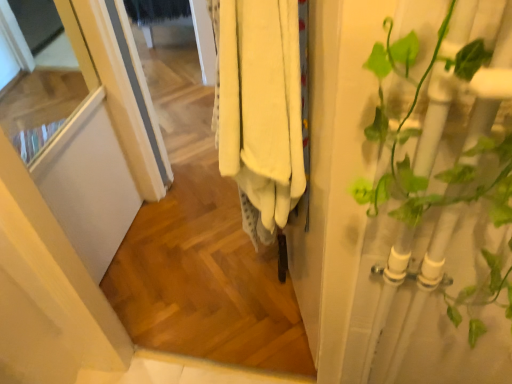
Question: Could you tell me if green leafy plant at right is turned towards white cotton towels at center?

Choices:
 (A) yes
 (B) no

Answer: (B)

Question: From a real-world perspective, is green leafy plant at right physically below white cotton towels at center?

Choices:
 (A) no
 (B) yes

Answer: (B)

Question: Would you say green leafy plant at right is a long distance from white cotton towels at center?

Choices:
 (A) yes
 (B) no

Answer: (B)

Question: Is green leafy plant at right facing away from white cotton towels at center?

Choices:
 (A) no
 (B) yes

Answer: (A)

Question: Is green leafy plant at right surrounding white cotton towels at center?

Choices:
 (A) yes
 (B) no

Answer: (B)

Question: Is green leafy plant at right outside of white cotton towels at center?

Choices:
 (A) yes
 (B) no

Answer: (A)

Question: Can you confirm if white matte screen door at left is bigger than green leafy plant at right?

Choices:
 (A) no
 (B) yes

Answer: (B)

Question: Considering the relative sizes of white matte screen door at left and green leafy plant at right in the image provided, is white matte screen door at left taller than green leafy plant at right?

Choices:
 (A) no
 (B) yes

Answer: (B)

Question: Is white matte screen door at left at the left side of green leafy plant at right?

Choices:
 (A) no
 (B) yes

Answer: (B)

Question: Is white matte screen door at left placed right next to green leafy plant at right?

Choices:
 (A) yes
 (B) no

Answer: (B)

Question: Does white matte screen door at left turn towards green leafy plant at right?

Choices:
 (A) yes
 (B) no

Answer: (B)

Question: Can you confirm if white matte screen door at left is smaller than green leafy plant at right?

Choices:
 (A) no
 (B) yes

Answer: (A)

Question: Considering the relative sizes of white matte screen door at left and white cotton towels at center in the image provided, is white matte screen door at left thinner than white cotton towels at center?

Choices:
 (A) no
 (B) yes

Answer: (B)